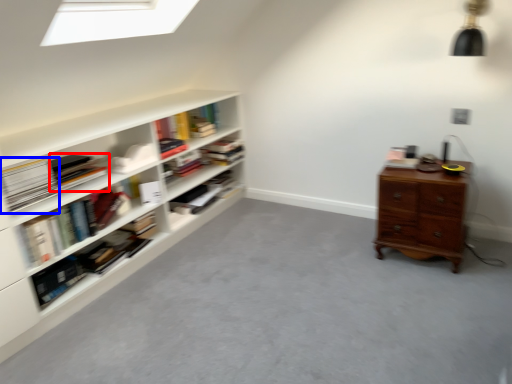
Question: Which of the following is the farthest to the observer, book (highlighted by a red box) or paperback book (highlighted by a blue box)?

Choices:
 (A) book
 (B) paperback book

Answer: (A)